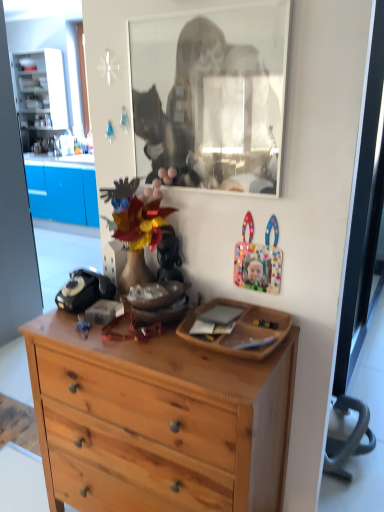
Question: From a real-world perspective, is matte plastic mask at center positioned above or below black glass mirror at upper center?

Choices:
 (A) below
 (B) above

Answer: (A)

Question: From the image's perspective, is matte plastic mask at center located above or below black glass mirror at upper center?

Choices:
 (A) below
 (B) above

Answer: (A)

Question: Which object is positioned closest to the black glass mirror at upper center?

Choices:
 (A) wooden tray at center
 (B) natural wood dresser at center
 (C) matte plastic mask at center

Answer: (C)

Question: Estimate the real-world distances between objects in this image. Which object is farther from the black glass mirror at upper center?

Choices:
 (A) wooden tray at center
 (B) matte plastic mask at center
 (C) natural wood dresser at center

Answer: (C)